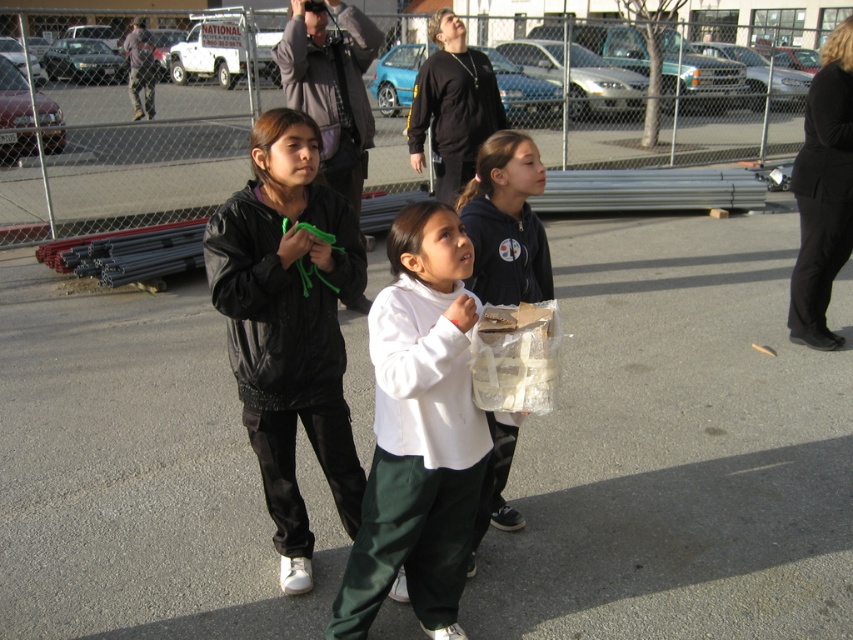
You are a photographer trying to capture the black fabric pants at right and the black matte sweatshirt at upper center in the same frame. Which object should you adjust your camera to focus on first to ensure both are in the shot?

You should focus on the black matte sweatshirt at upper center first because the black fabric pants at right is to the right of it, so adjusting from the leftmost point ensures both are included.